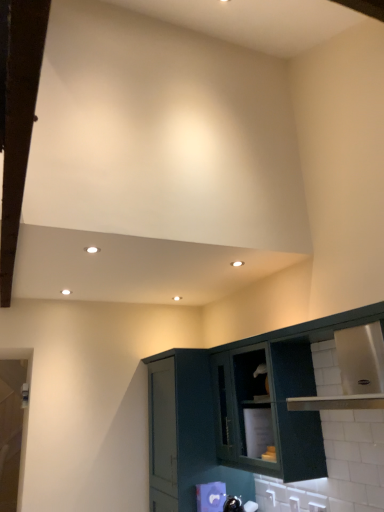
Question: Does white plastic electric outlet at lower right, the 1th electric outlet viewed from the front, have a greater height compared to stainless steel cabinet at lower right, marked as the 1th cabinetry in a right-to-left arrangement?

Choices:
 (A) no
 (B) yes

Answer: (A)

Question: Would you consider white plastic electric outlet at lower right, which is the third electric outlet in back-to-front order, to be distant from stainless steel cabinet at lower right, which is the second cabinetry from left to right?

Choices:
 (A) no
 (B) yes

Answer: (A)

Question: Can you confirm if white plastic electric outlet at lower right, the 1th electric outlet viewed from the front, is wider than stainless steel cabinet at lower right, marked as the 1th cabinetry in a right-to-left arrangement?

Choices:
 (A) no
 (B) yes

Answer: (A)

Question: Considering the relative sizes of white plastic electric outlet at lower right, acting as the 3th electric outlet starting from the left, and stainless steel cabinet at lower right, which is the second cabinetry from left to right, in the image provided, is white plastic electric outlet at lower right, acting as the 3th electric outlet starting from the left, shorter than stainless steel cabinet at lower right, which is the second cabinetry from left to right,?

Choices:
 (A) no
 (B) yes

Answer: (B)

Question: Is white plastic electric outlet at lower right, the 1th electric outlet viewed from the front, looking in the opposite direction of stainless steel cabinet at lower right, which is the second cabinetry from left to right?

Choices:
 (A) no
 (B) yes

Answer: (B)

Question: Is white plastic electric outlet at lower right, the 1th electric outlet viewed from the front, smaller than stainless steel cabinet at lower right, which is the second cabinetry from left to right?

Choices:
 (A) no
 (B) yes

Answer: (B)

Question: Is matte dark green cabinet at lower right at the right side of stainless steel cabinet at lower right, which is the second cabinetry from left to right?

Choices:
 (A) yes
 (B) no

Answer: (B)

Question: Does matte dark green cabinet at lower right have a lesser width compared to stainless steel cabinet at lower right, which is the second cabinetry from left to right?

Choices:
 (A) yes
 (B) no

Answer: (B)

Question: Would you consider matte dark green cabinet at lower right to be distant from stainless steel cabinet at lower right, marked as the 1th cabinetry in a right-to-left arrangement?

Choices:
 (A) no
 (B) yes

Answer: (A)

Question: From the image's perspective, is matte dark green cabinet at lower right located above stainless steel cabinet at lower right, which is the second cabinetry from left to right?

Choices:
 (A) no
 (B) yes

Answer: (B)

Question: From a real-world perspective, is matte dark green cabinet at lower right physically below stainless steel cabinet at lower right, which is the second cabinetry from left to right?

Choices:
 (A) yes
 (B) no

Answer: (B)

Question: Could stainless steel cabinet at lower right, marked as the 1th cabinetry in a right-to-left arrangement, be considered to be inside matte dark green cabinet at lower right?

Choices:
 (A) yes
 (B) no

Answer: (B)

Question: Is white plastic electric outlet at lower right, the 1th electric outlet when ordered from back to front, closer to camera compared to stainless steel cabinet at lower right, marked as the 1th cabinetry in a right-to-left arrangement?

Choices:
 (A) no
 (B) yes

Answer: (A)